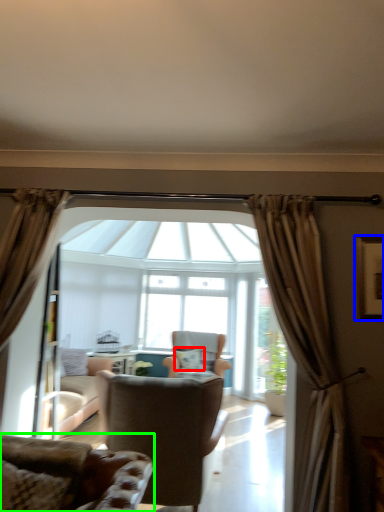
Question: Which object is positioned farthest from pillow (highlighted by a red box)? Select from picture frame (highlighted by a blue box) and chair (highlighted by a green box).

Choices:
 (A) picture frame
 (B) chair

Answer: (B)